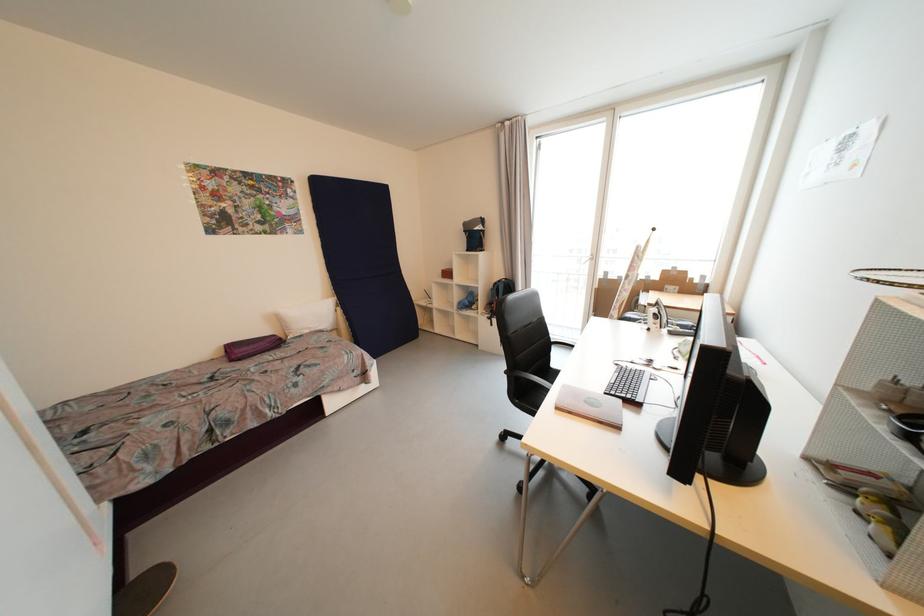
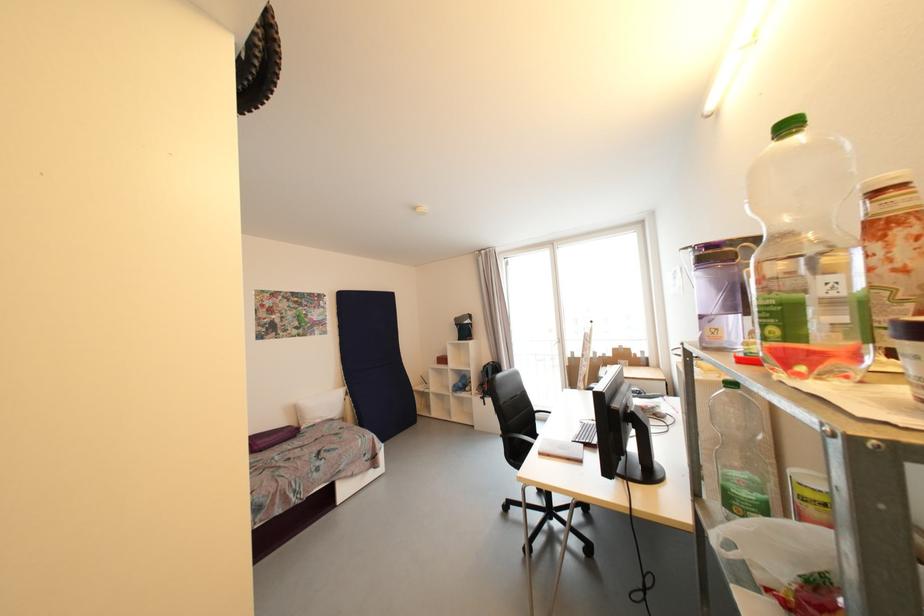
Where in the second image is the point corresponding to point 242,353 from the first image?

(263, 445)